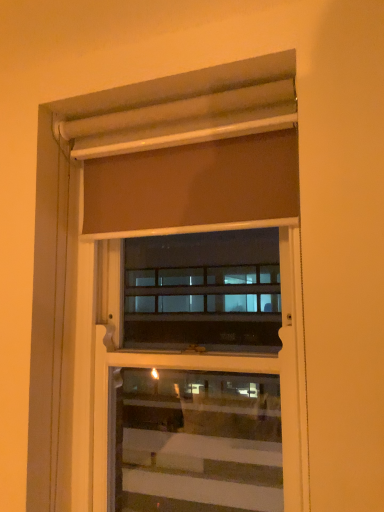
Where is `matte brown curtain at upper center`? The image size is (384, 512). matte brown curtain at upper center is located at coordinates (193, 186).

What do you see at coordinates (193, 186) in the screenshot?
I see `matte brown curtain at upper center` at bounding box center [193, 186].

I want to click on matte brown roller shade at upper center, so click(230, 371).

Looking at this image, measure the distance between matte brown roller shade at upper center and camera.

A distance of 33.78 inches exists between matte brown roller shade at upper center and camera.

Image resolution: width=384 pixels, height=512 pixels. Describe the element at coordinates (230, 371) in the screenshot. I see `matte brown roller shade at upper center` at that location.

This screenshot has width=384, height=512. Identify the location of matte brown curtain at upper center. (193, 186).

Is matte brown curtain at upper center at the left side of matte brown roller shade at upper center?

Indeed, matte brown curtain at upper center is positioned on the left side of matte brown roller shade at upper center.

Relative to matte brown roller shade at upper center, is matte brown curtain at upper center in front or behind?

In the image, matte brown curtain at upper center appears in front of matte brown roller shade at upper center.

Which is closer, [262,173] or [256,356]?

Positioned in front is point [262,173].

From the image's perspective, is matte brown curtain at upper center above matte brown roller shade at upper center?

Yes.

From a real-world perspective, relative to matte brown roller shade at upper center, is matte brown curtain at upper center vertically above or below?

In terms of real-world spatial position, matte brown curtain at upper center is above matte brown roller shade at upper center.

Considering the relative sizes of matte brown curtain at upper center and matte brown roller shade at upper center in the image provided, is matte brown curtain at upper center thinner than matte brown roller shade at upper center?

No, matte brown curtain at upper center is not thinner than matte brown roller shade at upper center.

Considering the relative sizes of matte brown curtain at upper center and matte brown roller shade at upper center in the image provided, is matte brown curtain at upper center taller than matte brown roller shade at upper center?

In fact, matte brown curtain at upper center may be shorter than matte brown roller shade at upper center.

Is matte brown curtain at upper center bigger than matte brown roller shade at upper center?

No, matte brown curtain at upper center is not bigger than matte brown roller shade at upper center.

Is matte brown curtain at upper center inside or outside of matte brown roller shade at upper center?

matte brown curtain at upper center is not enclosed by matte brown roller shade at upper center.

Is there a large distance between matte brown curtain at upper center and matte brown roller shade at upper center?

No, matte brown curtain at upper center is in close proximity to matte brown roller shade at upper center.

Is matte brown curtain at upper center oriented towards matte brown roller shade at upper center?

No, matte brown curtain at upper center does not turn towards matte brown roller shade at upper center.

Based on the photo, can you tell me how much matte brown curtain at upper center and matte brown roller shade at upper center differ in facing direction?

matte brown curtain at upper center and matte brown roller shade at upper center are facing 0.00555 degrees away from each other.

You are a GUI agent. You are given a task and a screenshot of the screen. Output one action in this format:
    pyautogui.click(x=<x>, y=<y>)
    Task: Click on the screen door on the right of matte brown curtain at upper center
    The image size is (384, 512).
    Given the screenshot: What is the action you would take?
    pyautogui.click(x=230, y=371)

Based on their positions, is matte brown roller shade at upper center located to the left or right of matte brown curtain at upper center?

matte brown roller shade at upper center is positioned on matte brown curtain at upper center's right side.

Which is in front, matte brown roller shade at upper center or matte brown curtain at upper center?

Positioned in front is matte brown curtain at upper center.

Considering the points (289, 283) and (273, 166), which point is in front, point (289, 283) or point (273, 166)?

Positioned in front is point (273, 166).

From the picture: From the image's perspective, which one is positioned higher, matte brown roller shade at upper center or matte brown curtain at upper center?

matte brown curtain at upper center, from the image's perspective.

From a real-world perspective, which object rests below the other?

In real-world perspective, matte brown roller shade at upper center is lower.

Which object is wider, matte brown roller shade at upper center or matte brown curtain at upper center?

matte brown curtain at upper center is wider.

Between matte brown roller shade at upper center and matte brown curtain at upper center, which one has more height?

Standing taller between the two is matte brown roller shade at upper center.

Can you confirm if matte brown roller shade at upper center is smaller than matte brown curtain at upper center?

Actually, matte brown roller shade at upper center might be larger than matte brown curtain at upper center.

Can we say matte brown roller shade at upper center lies outside matte brown curtain at upper center?

That's correct, matte brown roller shade at upper center is outside of matte brown curtain at upper center.

Is matte brown roller shade at upper center placed right next to matte brown curtain at upper center?

No.

Is matte brown roller shade at upper center positioned with its back to matte brown curtain at upper center?

Yes, matte brown roller shade at upper center is facing away from matte brown curtain at upper center.

Identify the location of curtain that appears above the matte brown roller shade at upper center (from a real-world perspective). (193, 186).

Where is `screen door below the matte brown curtain at upper center (from the image's perspective)`? screen door below the matte brown curtain at upper center (from the image's perspective) is located at coordinates (230, 371).

Identify the location of screen door below the matte brown curtain at upper center (from a real-world perspective). The height and width of the screenshot is (512, 384). (230, 371).